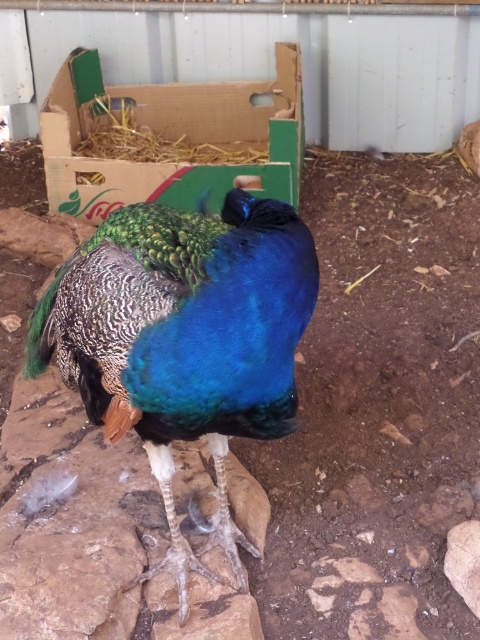
You are standing in the barn where the peacock is. There are two points marked in the scene. The first point is at coordinates point (285,300) and the second point is at point (93,150). Which point is closer to you?

Point (285,300) is in front of point (93,150), so the first point is closer to you.

You are a farmer who needs to locate the shiny blue peacock at center in the barn. Where would you look relative to the straw hay at upper center?

The shiny blue peacock at center is in front of the straw hay at upper center, so you should look towards the front side of the straw hay at upper center to find the peacock.

You are standing in the barn and need to place a new item on the cardboard box at upper center. According to the scene description, where exactly is the cardboard box positioned?

The cardboard box at upper center is located at point [169,138].